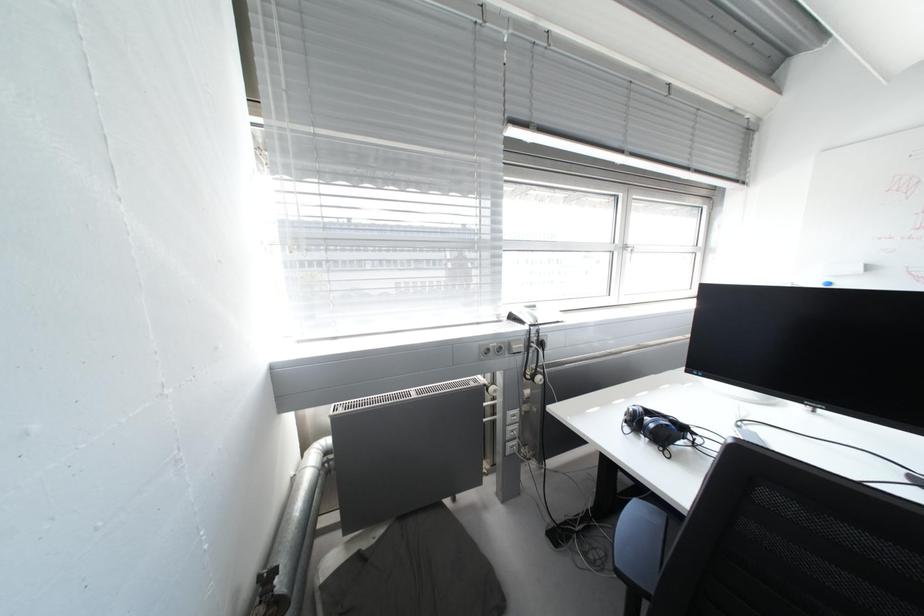
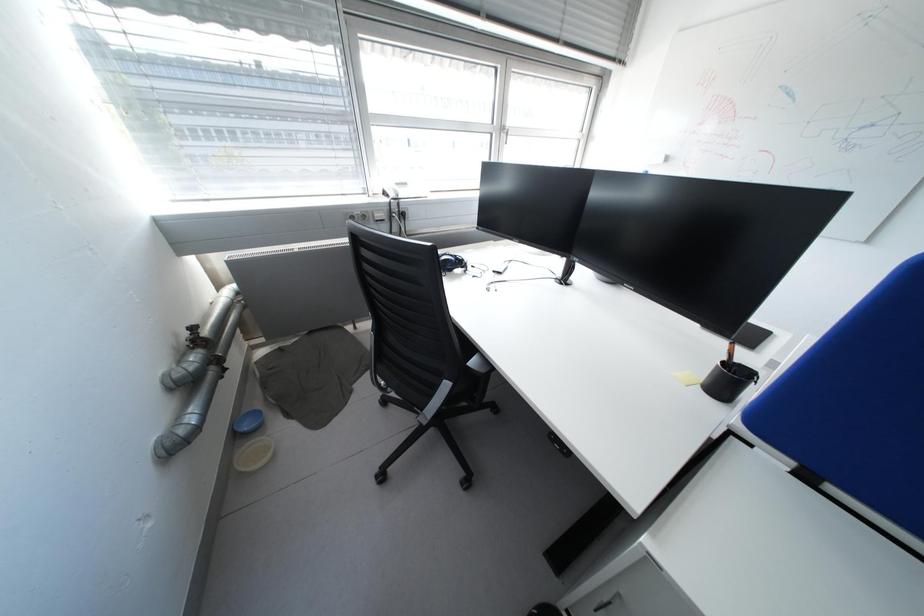
Which direction would the cameraman need to move to produce the second image?

The cameraman moved toward right, backward.